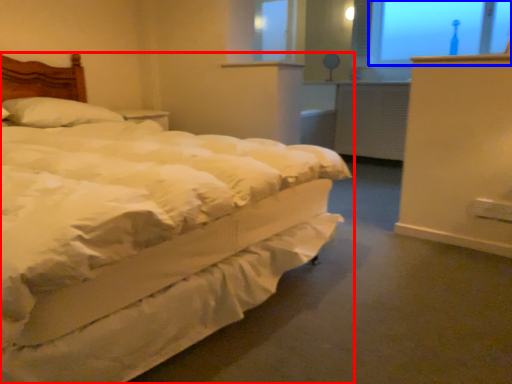
Question: Which object appears farthest to the camera in this image, bed (highlighted by a red box) or window screen (highlighted by a blue box)?

Choices:
 (A) bed
 (B) window screen

Answer: (B)